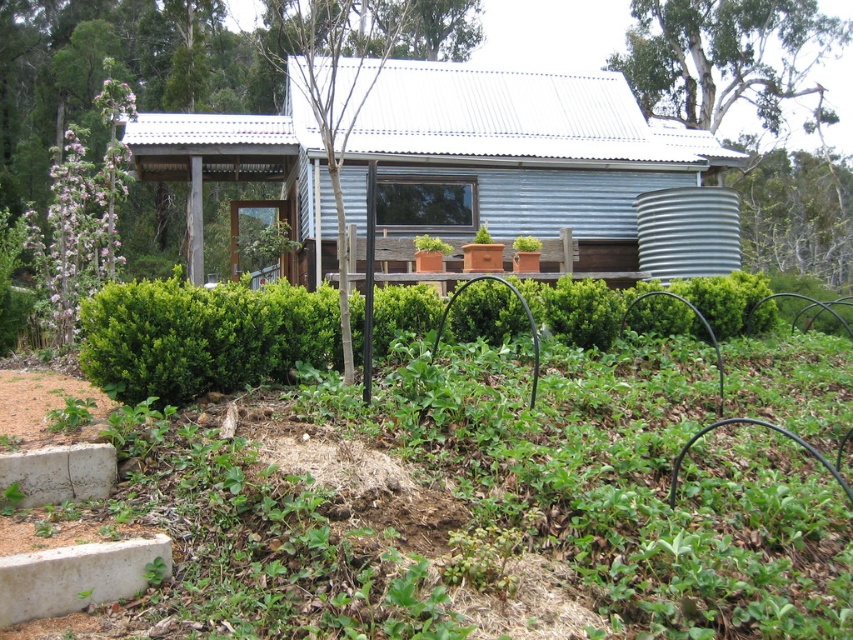
Is the position of green leafy hedge at center more distant than that of white bark tree at upper right?

That is False.

Does green leafy hedge at center have a larger size compared to white bark tree at upper right?

Actually, green leafy hedge at center might be smaller than white bark tree at upper right.

What do you see at coordinates (201, 337) in the screenshot? I see `green leafy hedge at center` at bounding box center [201, 337].

What are the coordinates of `green leafy hedge at center` in the screenshot? It's located at (201, 337).